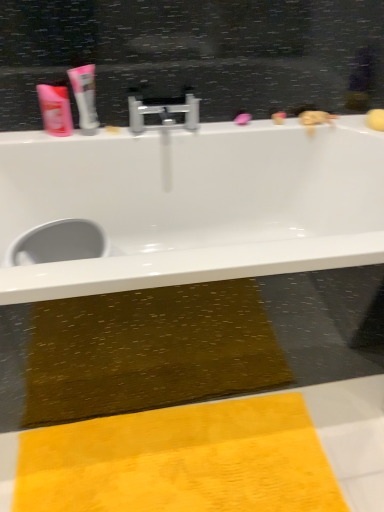
The image size is (384, 512). Identify the location of vacant area situated below yellow textured towel at lower center (from a real-world perspective). (189, 460).